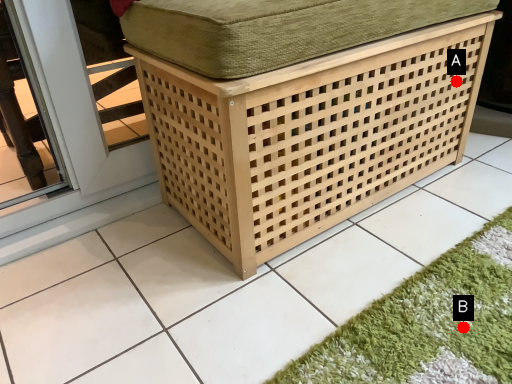
Question: Two points are circled on the image, labeled by A and B beside each circle. Which point is closer to the camera?

Choices:
 (A) A is closer
 (B) B is closer

Answer: (B)